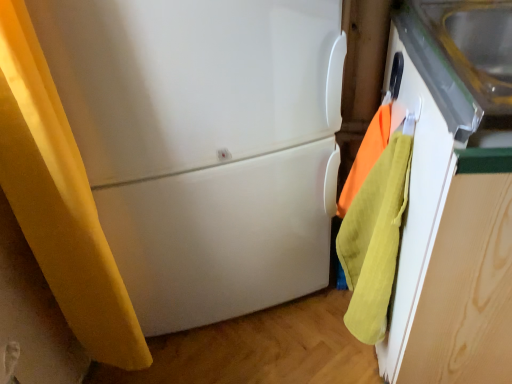
Describe the element at coordinates (204, 145) in the screenshot. Image resolution: width=512 pixels, height=384 pixels. I see `white matte refrigerator at center` at that location.

Where is `white matte refrigerator at center`? This screenshot has width=512, height=384. white matte refrigerator at center is located at coordinates (204, 145).

In order to face white matte refrigerator at center, should I rotate leftwards or rightwards?

Turn left approximately 7.354 degrees to face it.

What is the approximate width of white matte refrigerator at center?

The width of white matte refrigerator at center is 19.42 inches.

This screenshot has width=512, height=384. What do you see at coordinates (366, 156) in the screenshot? I see `orange cotton towel at right` at bounding box center [366, 156].

At what (x,y) coordinates should I click in order to perform the action: click on orange cotton towel at right. Please return your answer as a coordinate pair (x, y). The width and height of the screenshot is (512, 384). Looking at the image, I should click on click(366, 156).

Find the location of a particular element. Image resolution: width=512 pixels, height=384 pixels. white matte refrigerator at center is located at coordinates (204, 145).

Can you confirm if white matte refrigerator at center is positioned to the right of orange cotton towel at right?

No, white matte refrigerator at center is not to the right of orange cotton towel at right.

Which object is more forward, white matte refrigerator at center or orange cotton towel at right?

white matte refrigerator at center is more forward.

Which point is more distant from viewer, (122, 147) or (346, 192)?

The point (346, 192) is more distant.

From the image's perspective, does white matte refrigerator at center appear higher than orange cotton towel at right?

Indeed, from the image's perspective, white matte refrigerator at center is shown above orange cotton towel at right.

Based on the photo, from a real-world perspective, which is physically below, white matte refrigerator at center or orange cotton towel at right?

In real-world perspective, white matte refrigerator at center is lower.

Considering the relative sizes of white matte refrigerator at center and orange cotton towel at right in the image provided, is white matte refrigerator at center thinner than orange cotton towel at right?

No.

Between white matte refrigerator at center and orange cotton towel at right, which one has more height?

white matte refrigerator at center is taller.

In the scene shown: Does white matte refrigerator at center have a larger size compared to orange cotton towel at right?

Yes.

Do you think white matte refrigerator at center is within orange cotton towel at right, or outside of it?

white matte refrigerator at center is not inside orange cotton towel at right, it's outside.

Is white matte refrigerator at center directly adjacent to orange cotton towel at right?

No, white matte refrigerator at center is not beside orange cotton towel at right.

Does white matte refrigerator at center turn towards orange cotton towel at right?

No, white matte refrigerator at center is not facing towards orange cotton towel at right.

Can you tell me how much white matte refrigerator at center and orange cotton towel at right differ in facing direction?

The angle between the facing direction of white matte refrigerator at center and the facing direction of orange cotton towel at right is 17.9 degrees.

You are a GUI agent. You are given a task and a screenshot of the screen. Output one action in this format:
    pyautogui.click(x=<x>, y=<y>)
    Task: Click on the refrigerator located in front of the orange cotton towel at right
    This screenshot has width=512, height=384.
    Given the screenshot: What is the action you would take?
    pyautogui.click(x=204, y=145)

Which is more to the left, orange cotton towel at right or white matte refrigerator at center?

white matte refrigerator at center is more to the left.

Is the position of orange cotton towel at right less distant than that of white matte refrigerator at center?

No, the depth of orange cotton towel at right is greater than that of white matte refrigerator at center.

Does point (349, 172) come closer to viewer compared to point (323, 63)?

No, (349, 172) is further to viewer.

From the image's perspective, which is below, orange cotton towel at right or white matte refrigerator at center?

orange cotton towel at right is shown below in the image.

From a real-world perspective, is orange cotton towel at right above or below white matte refrigerator at center?

Clearly, from a real-world perspective, orange cotton towel at right is above white matte refrigerator at center.

Between orange cotton towel at right and white matte refrigerator at center, which one has smaller width?

orange cotton towel at right.

Does orange cotton towel at right have a lesser height compared to white matte refrigerator at center?

Yes.

Between orange cotton towel at right and white matte refrigerator at center, which one has smaller size?

With smaller size is orange cotton towel at right.

Is orange cotton towel at right located outside white matte refrigerator at center?

Yes.

Are orange cotton towel at right and white matte refrigerator at center far apart?

No, there isn't a large distance between orange cotton towel at right and white matte refrigerator at center.

In the scene shown: Could you tell me if orange cotton towel at right is turned towards white matte refrigerator at center?

No, orange cotton towel at right is not oriented towards white matte refrigerator at center.

How different are the orientations of orange cotton towel at right and white matte refrigerator at center in degrees?

17.9 degrees separate the facing orientations of orange cotton towel at right and white matte refrigerator at center.

You are a GUI agent. You are given a task and a screenshot of the screen. Output one action in this format:
    pyautogui.click(x=<x>, y=<y>)
    Task: Click on the beach towel that is above the white matte refrigerator at center (from a real-world perspective)
    The height and width of the screenshot is (384, 512).
    Given the screenshot: What is the action you would take?
    pyautogui.click(x=366, y=156)

The height and width of the screenshot is (384, 512). I want to click on beach towel above the white matte refrigerator at center (from a real-world perspective), so click(366, 156).

Locate an element on the screen. refrigerator on the left of orange cotton towel at right is located at coordinates (204, 145).